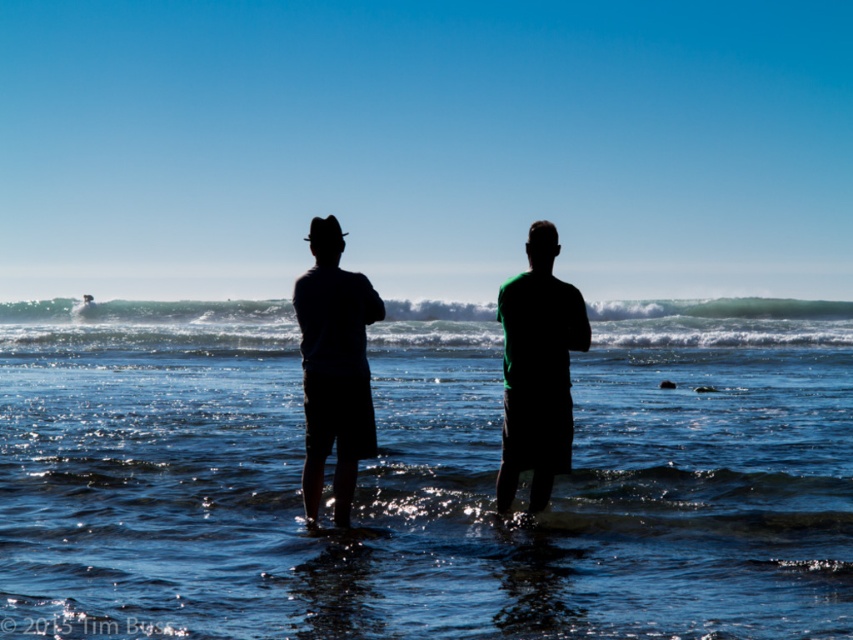
You are standing at the beach and want to reach the blue liquid water at center to collect a sample. Considering the distance, can you walk directly to it without needing any assistance?

The blue liquid water at center is 28.72 feet away from the viewer. Since this distance is within a manageable walking range, you can walk directly to it without needing any assistance.

In the scene shown: You are a photographer trying to capture the person in the green top at the beach. You want to focus on the point at coordinates (537, 369). Where exactly on the person should you aim your camera?

The point at coordinates (537, 369) is on the green matte shirt at center, so you should aim your camera at the center of the green matte shirt to capture that point.